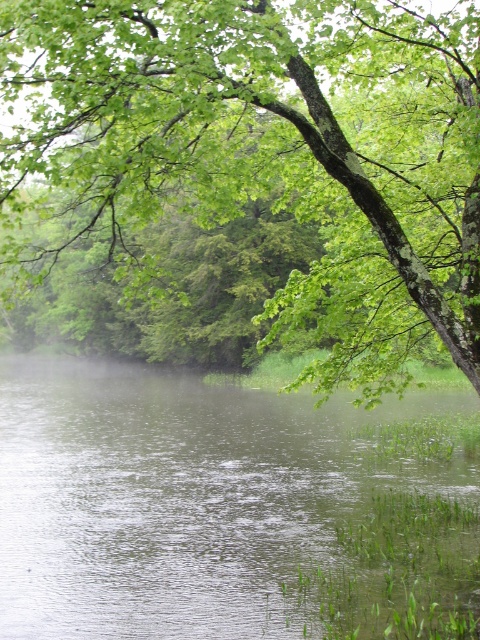
Which is in front, point (81, 122) or point (277, 560)?

Point (81, 122) is in front.

Is green leafy tree at upper center further to the viewer compared to clear water at center?

No, green leafy tree at upper center is closer to the viewer.

Between point (422, 128) and point (169, 438), which one is positioned in front?

Point (422, 128)

Find the location of a particular element. green leafy tree at upper center is located at coordinates (274, 147).